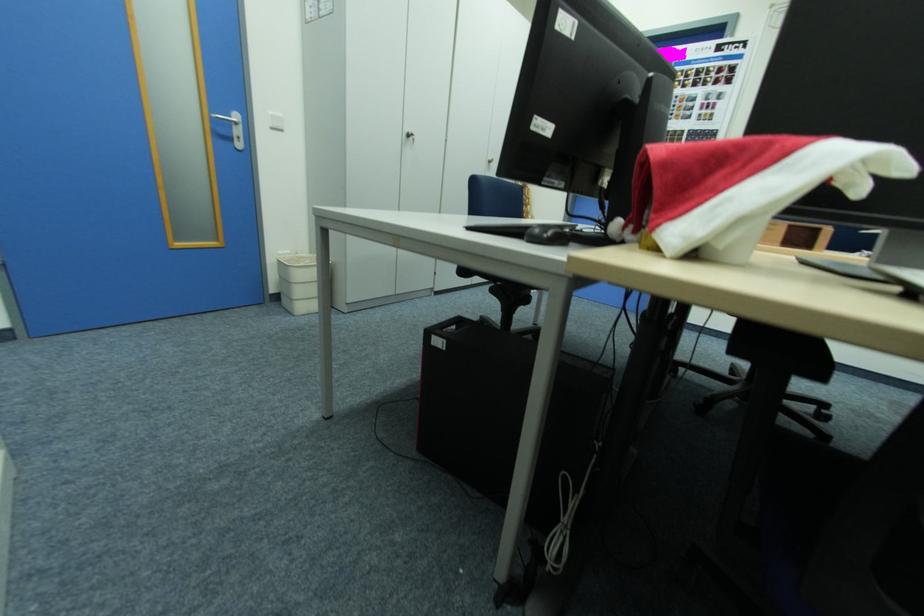
The height and width of the screenshot is (616, 924). Find the location of `white light switch`. white light switch is located at coordinates (275, 121).